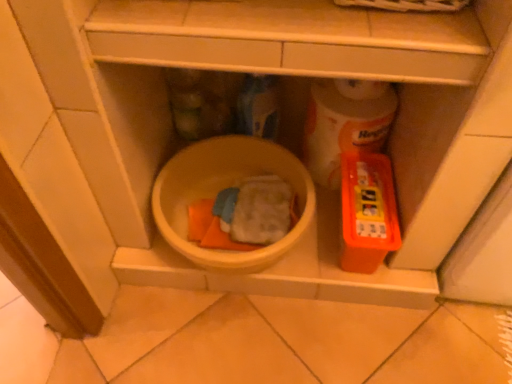
Describe the element at coordinates (367, 212) in the screenshot. I see `orange plastic container at right` at that location.

This screenshot has height=384, width=512. What do you see at coordinates (345, 123) in the screenshot?
I see `white glossy toilet paper at center right` at bounding box center [345, 123].

What is the approximate width of white glossy toilet paper at center right?

white glossy toilet paper at center right is 3.11 inches in width.

Image resolution: width=512 pixels, height=384 pixels. Identify the location of orange plastic container at right. (367, 212).

From the image's perspective, between orange plastic container at right and yellow matte mixing bowl at center, who is located below?

orange plastic container at right appears lower in the image.

Is orange plastic container at right outside of yellow matte mixing bowl at center?

Yes, orange plastic container at right is outside of yellow matte mixing bowl at center.

Does point (375, 257) come behind point (315, 198)?

No, it is not.

Is orange plastic container at right facing away from yellow matte mixing bowl at center?

orange plastic container at right does not have its back to yellow matte mixing bowl at center.

Which of these two, white glossy toilet paper at center right or orange plastic container at right, is bigger?

Bigger between the two is orange plastic container at right.

From a real-world perspective, which object rests below the other?

orange plastic container at right is physically lower.

Considering the relative sizes of white glossy toilet paper at center right and orange plastic container at right in the image provided, is white glossy toilet paper at center right thinner than orange plastic container at right?

Yes.

Is yellow matte mixing bowl at center facing towards orange plastic container at right?

No, yellow matte mixing bowl at center is not facing towards orange plastic container at right.

Identify the location of mixing bowl that is under the orange plastic container at right (from a real-world perspective). This screenshot has height=384, width=512. (222, 189).

From the picture: Is yellow matte mixing bowl at center taller or shorter than orange plastic container at right?

Clearly, yellow matte mixing bowl at center is shorter compared to orange plastic container at right.

Between yellow matte mixing bowl at center and white glossy toilet paper at center right, which one is positioned behind?

Positioned behind is white glossy toilet paper at center right.

Is there a large distance between yellow matte mixing bowl at center and white glossy toilet paper at center right?

No, there isn't a large distance between yellow matte mixing bowl at center and white glossy toilet paper at center right.

From a real-world perspective, which is physically above, yellow matte mixing bowl at center or white glossy toilet paper at center right?

white glossy toilet paper at center right, from a real-world perspective.

Image resolution: width=512 pixels, height=384 pixels. I want to click on toilet paper lying on the right of yellow matte mixing bowl at center, so click(x=345, y=123).

Is orange plastic container at right far from white glossy toilet paper at center right?

No, orange plastic container at right is not far from white glossy toilet paper at center right.

In the scene shown: Is orange plastic container at right surrounding white glossy toilet paper at center right?

Yes.

Which is in front, point (342, 189) or point (382, 140)?

Positioned in front is point (342, 189).

Who is taller, orange plastic container at right or white glossy toilet paper at center right?

With more height is white glossy toilet paper at center right.

Is white glossy toilet paper at center right facing towards yellow matte mixing bowl at center?

No.

From the image's perspective, which object appears higher, white glossy toilet paper at center right or yellow matte mixing bowl at center?

white glossy toilet paper at center right appears higher in the image.

Could you measure the distance between white glossy toilet paper at center right and yellow matte mixing bowl at center?

white glossy toilet paper at center right is 8.01 inches away from yellow matte mixing bowl at center.

Considering the sizes of objects white glossy toilet paper at center right and yellow matte mixing bowl at center in the image provided, who is wider, white glossy toilet paper at center right or yellow matte mixing bowl at center?

yellow matte mixing bowl at center.

The height and width of the screenshot is (384, 512). Identify the location of toy above the yellow matte mixing bowl at center (from a real-world perspective). (367, 212).

The image size is (512, 384). I want to click on toy below the white glossy toilet paper at center right (from the image's perspective), so click(x=367, y=212).

Based on their spatial positions, is white glossy toilet paper at center right or orange plastic container at right further from yellow matte mixing bowl at center?

orange plastic container at right is further to yellow matte mixing bowl at center.

Based on their spatial positions, is orange plastic container at right or white glossy toilet paper at center right closer to yellow matte mixing bowl at center?

Among the two, white glossy toilet paper at center right is located nearer to yellow matte mixing bowl at center.

Estimate the real-world distances between objects in this image. Which object is further from white glossy toilet paper at center right, yellow matte mixing bowl at center or orange plastic container at right?

The object further to white glossy toilet paper at center right is yellow matte mixing bowl at center.

When comparing their distances from white glossy toilet paper at center right, does orange plastic container at right or yellow matte mixing bowl at center seem further?

Based on the image, yellow matte mixing bowl at center appears to be further to white glossy toilet paper at center right.

Based on their spatial positions, is yellow matte mixing bowl at center or white glossy toilet paper at center right closer to orange plastic container at right?

Based on the image, white glossy toilet paper at center right appears to be nearer to orange plastic container at right.

Which object lies further to the anchor point orange plastic container at right, white glossy toilet paper at center right or yellow matte mixing bowl at center?

Based on the image, yellow matte mixing bowl at center appears to be further to orange plastic container at right.

Identify the location of toilet paper between yellow matte mixing bowl at center and orange plastic container at right in the horizontal direction. (345, 123).